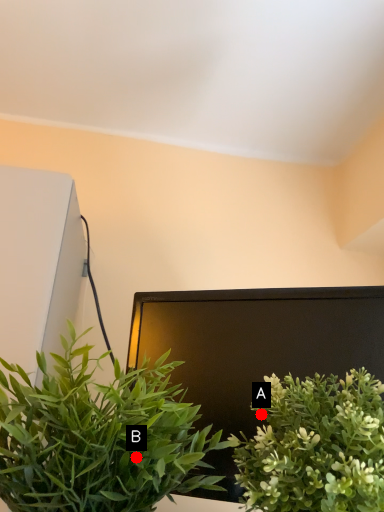
Question: Two points are circled on the image, labeled by A and B beside each circle. Which point appears farthest from the camera in this image?

Choices:
 (A) A is further
 (B) B is further

Answer: (A)